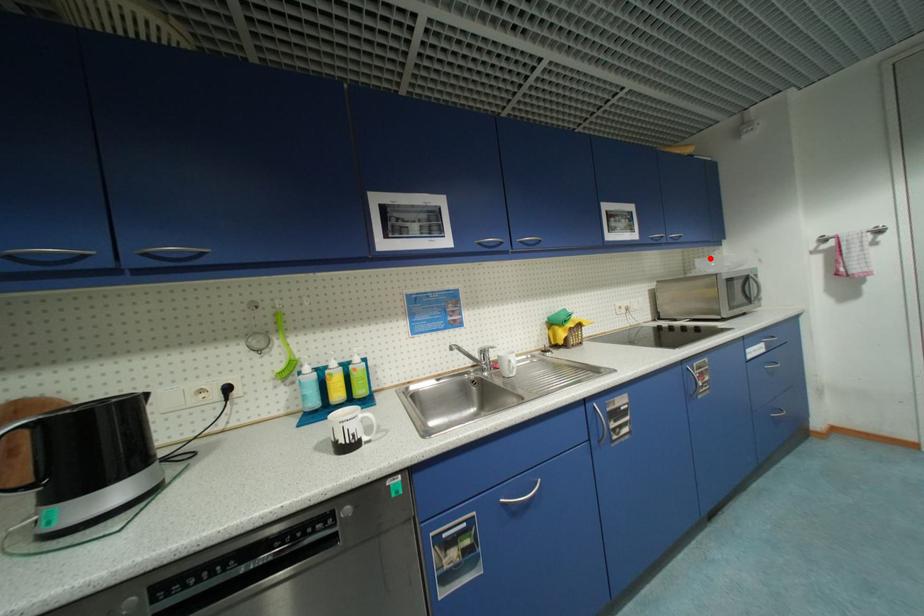
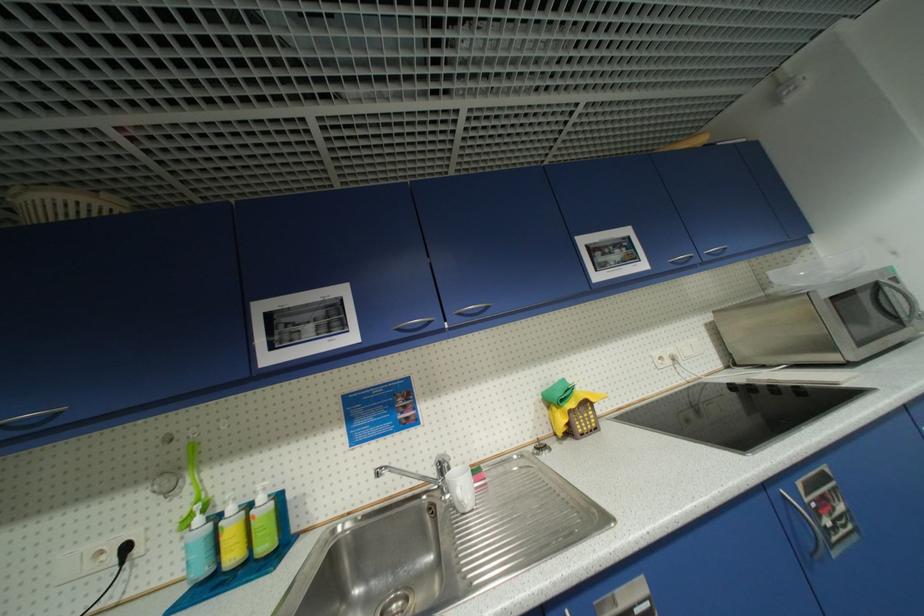
Locate, in the second image, the point that corresponds to the highlighted location in the first image.

(793, 265)